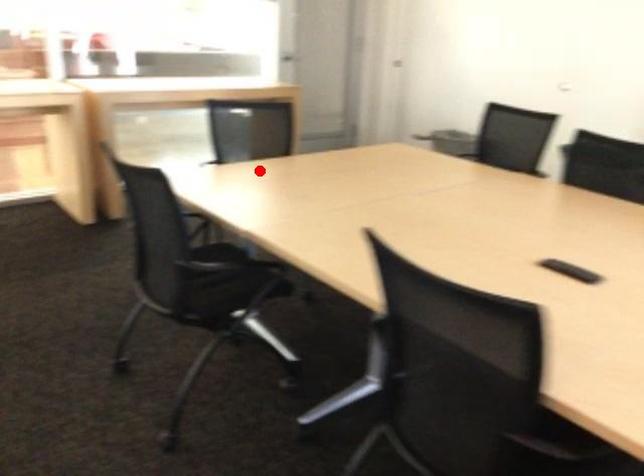
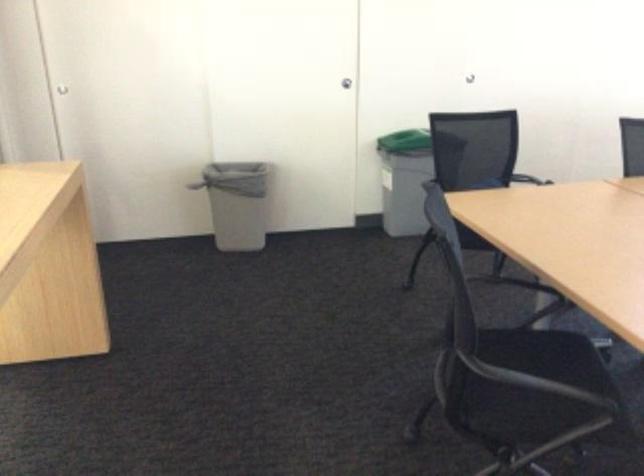
The point at the highlighted location is marked in the first image. Where is the corresponding point in the second image?

(542, 347)